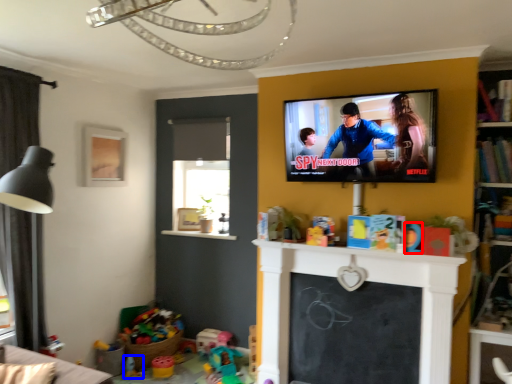
Question: Which object appears farthest to the camera in this image, toy (highlighted by a red box) or toy (highlighted by a blue box)?

Choices:
 (A) toy
 (B) toy

Answer: (B)